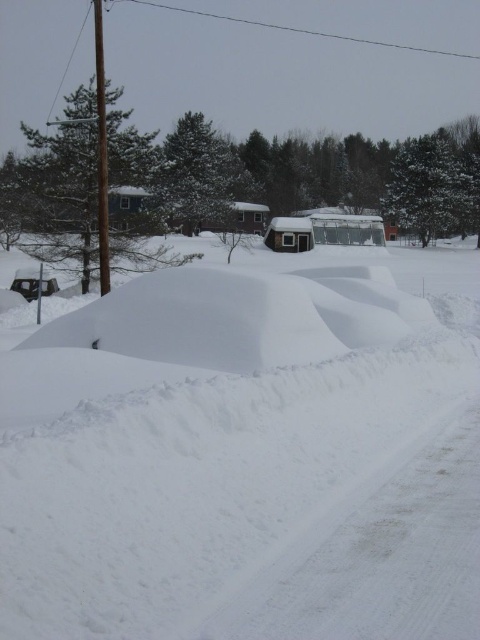
Question: Can you confirm if white fluffy snow at center is wider than shiny black car at left?

Choices:
 (A) no
 (B) yes

Answer: (B)

Question: Which point appears closest to the camera in this image?

Choices:
 (A) (54, 289)
 (B) (132, 360)

Answer: (B)

Question: Which point is closer to the camera?

Choices:
 (A) white fluffy snow at center
 (B) shiny black car at left

Answer: (A)

Question: Is white fluffy snow at center below shiny black car at left?

Choices:
 (A) no
 (B) yes

Answer: (B)

Question: Considering the relative positions of white fluffy snow at center and shiny black car at left in the image provided, where is white fluffy snow at center located with respect to shiny black car at left?

Choices:
 (A) left
 (B) right

Answer: (B)

Question: Which point is farther to the camera?

Choices:
 (A) white fluffy snow at center
 (B) shiny black car at left

Answer: (B)